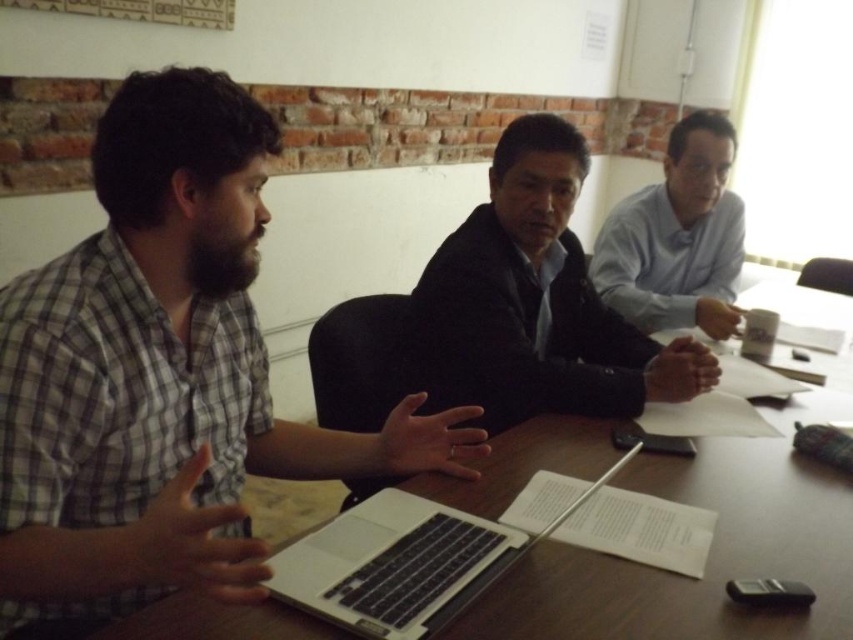
Between point (126, 515) and point (624, 360), which one is positioned in front?

Point (126, 515)

Image resolution: width=853 pixels, height=640 pixels. I want to click on matte black laptop at left, so click(x=161, y=378).

Which is behind, point (149, 92) or point (498, 310)?

Positioned behind is point (498, 310).

Locate an element on the screen. The width and height of the screenshot is (853, 640). matte black laptop at left is located at coordinates coord(161,378).

Who is positioned more to the left, wooden table at center or white glossy shirt at upper right?

From the viewer's perspective, wooden table at center appears more on the left side.

Which is more to the right, wooden table at center or white glossy shirt at upper right?

white glossy shirt at upper right is more to the right.

You are a GUI agent. You are given a task and a screenshot of the screen. Output one action in this format:
    pyautogui.click(x=<x>, y=<y>)
    Task: Click on the wooden table at center
    This screenshot has height=640, width=853.
    Given the screenshot: What is the action you would take?
    pyautogui.click(x=709, y=554)

Is black suit at center in front of silver/black keyboard at center?

No, black suit at center is behind silver/black keyboard at center.

Consider the image. Does black suit at center come behind silver/black keyboard at center?

Yes, it is.

Who is more distant from viewer, (604, 346) or (312, 596)?

Positioned behind is point (604, 346).

Locate an element on the screen. black suit at center is located at coordinates (535, 301).